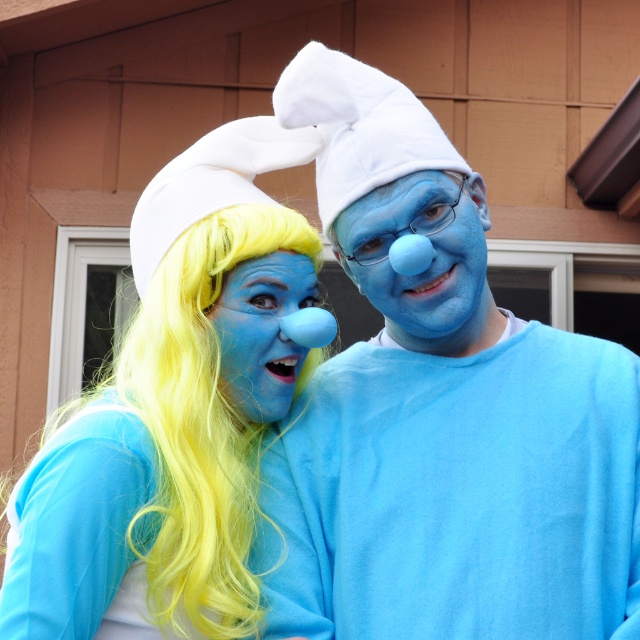
Who is shorter, matte blue costume at center or yellow synthetic hair at center?

yellow synthetic hair at center is shorter.

Looking at this image, can you confirm if matte blue costume at center is positioned to the left of yellow synthetic hair at center?

Incorrect, matte blue costume at center is not on the left side of yellow synthetic hair at center.

Locate an element on the screen. Image resolution: width=640 pixels, height=640 pixels. matte blue costume at center is located at coordinates (440, 413).

Who is positioned more to the right, yellow synthetic hair at center or matte blue nose at center?

From the viewer's perspective, matte blue nose at center appears more on the right side.

Does yellow synthetic hair at center have a lesser width compared to matte blue nose at center?

No.

Between point (189, 604) and point (246, 412), which one is positioned in front?

Point (189, 604) is more forward.

Identify the location of yellow synthetic hair at center. The image size is (640, 640). (157, 460).

Is matte blue costume at center above matte blue nose at center?

Actually, matte blue costume at center is below matte blue nose at center.

Does point (452, 326) come closer to viewer compared to point (275, 269)?

That is False.

Which is behind, point (508, 440) or point (260, 394)?

Positioned behind is point (508, 440).

The width and height of the screenshot is (640, 640). I want to click on matte blue costume at center, so click(x=440, y=413).